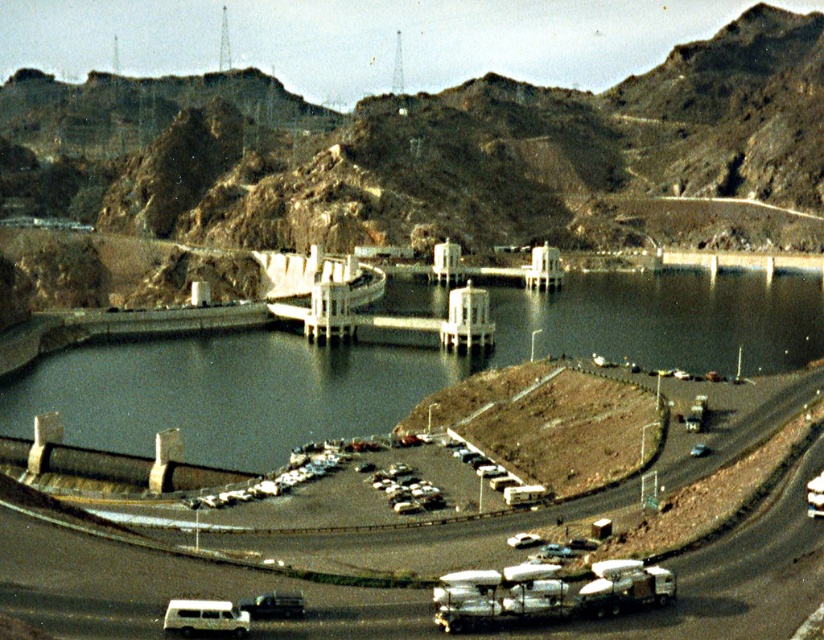
Question: Among these points, which one is nearest to the camera?

Choices:
 (A) (279, 596)
 (B) (621, 308)
 (C) (209, 614)

Answer: (C)

Question: Does clear water at center come in front of smooth asphalt highway at lower center?

Choices:
 (A) no
 (B) yes

Answer: (A)

Question: In this image, where is white matte van at lower left located relative to white matte car at center?

Choices:
 (A) above
 (B) below

Answer: (B)

Question: Which point appears farthest from the camera in this image?

Choices:
 (A) (340, 536)
 (B) (293, 602)

Answer: (A)

Question: Is clear water at center closer to the viewer compared to smooth asphalt highway at lower center?

Choices:
 (A) yes
 (B) no

Answer: (B)

Question: Which object appears farthest from the camera in this image?

Choices:
 (A) clear water at center
 (B) smooth asphalt highway at lower center
 (C) white matte van at lower left
 (D) metallic silver car at center

Answer: (A)